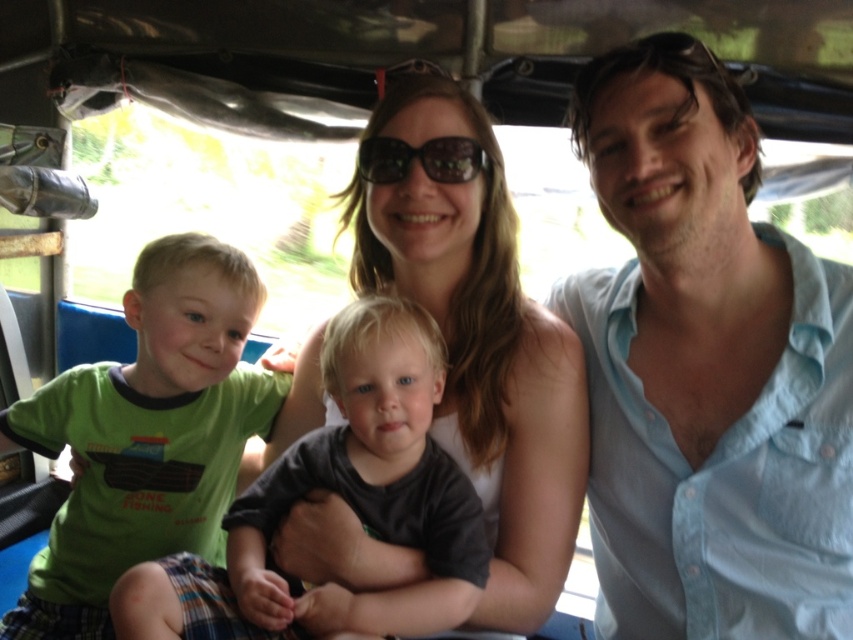
Does matte white shirt at center have a larger size compared to dark reflective sunglasses at center?

Yes.

The image size is (853, 640). What are the coordinates of `matte white shirt at center` in the screenshot? It's located at (480, 346).

Is light blue button-down shirt at right shorter than matte white shirt at center?

No, light blue button-down shirt at right is not shorter than matte white shirt at center.

This screenshot has height=640, width=853. In order to click on light blue button-down shirt at right in this screenshot , I will do `click(706, 369)`.

Who is more distant from viewer, (724, 256) or (381, 132)?

The point (381, 132) is behind.

What are the coordinates of `light blue button-down shirt at right` in the screenshot? It's located at (706, 369).

This screenshot has width=853, height=640. Identify the location of matte white shirt at center. (480, 346).

Is matte white shirt at center taller than green cotton shirt at center?

Yes.

Who is more distant from viewer, (x=311, y=358) or (x=256, y=561)?

The point (x=311, y=358) is behind.

Locate an element on the screen. This screenshot has height=640, width=853. matte white shirt at center is located at coordinates (480, 346).